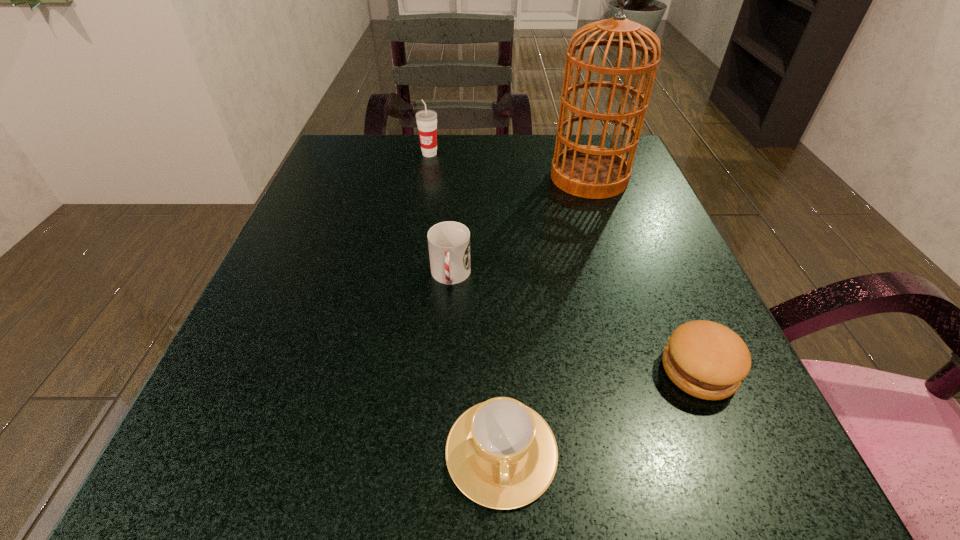
Locate an element on the screen. free space located 0.400m on the back of the hamburger is located at coordinates tap(623, 190).

Where is `birdcage present at the far edge`? This screenshot has height=540, width=960. birdcage present at the far edge is located at coordinates (595, 172).

Locate an element on the screen. The height and width of the screenshot is (540, 960). cup situated at the far edge is located at coordinates (426, 120).

Image resolution: width=960 pixels, height=540 pixels. I want to click on object that is positioned at the near edge, so click(x=501, y=454).

This screenshot has height=540, width=960. Identify the location of birdcage present at the right edge. (595, 172).

Where is `hamburger located in the right edge section of the desktop`? hamburger located in the right edge section of the desktop is located at coordinates (707, 360).

Where is `object that is at the far right corner`? object that is at the far right corner is located at coordinates (595, 172).

This screenshot has height=540, width=960. In the image, there is a desktop. In order to click on free space at the far edge in this screenshot , I will do `click(441, 166)`.

Locate an element on the screen. vacant space at the near edge is located at coordinates (575, 509).

The height and width of the screenshot is (540, 960). Identify the location of vacant area at the left edge. (262, 339).